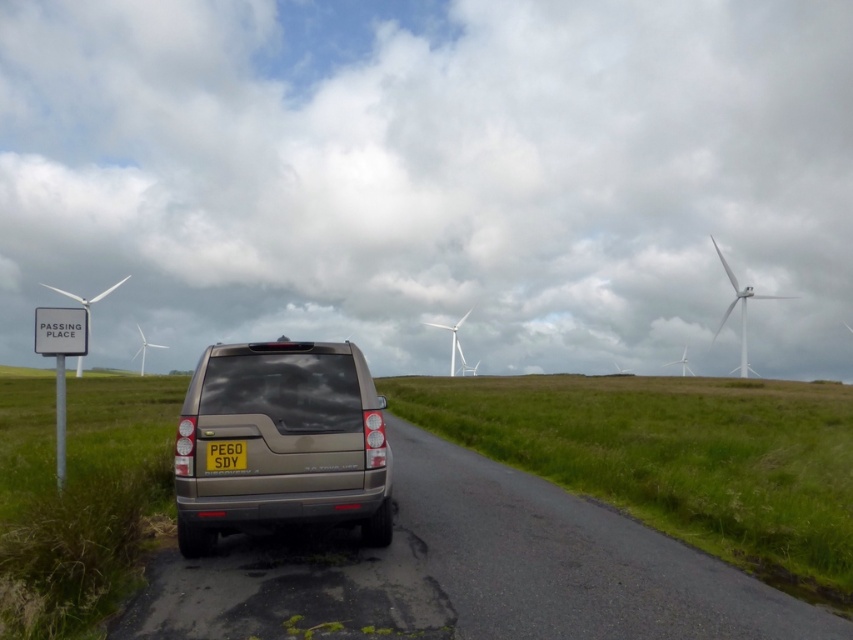
You are standing at the point closer to the bottom of the image. There are two points marked in the scene, one at point [714,337] and another at point [154,342]. Which point is farther away from you?

Point [714,337] is behind point [154,342], so it is farther away from you.

You are standing at the point marked by the coordinates point (740, 307). Looking towards the direction of the silver SUV parked on the side of the road, which object is directly behind you?

The point (740, 307) corresponds to the white matte wind turbine at right. Since you are facing the silver SUV parked on the side of the road, the white matte wind turbine at right would be directly behind you.